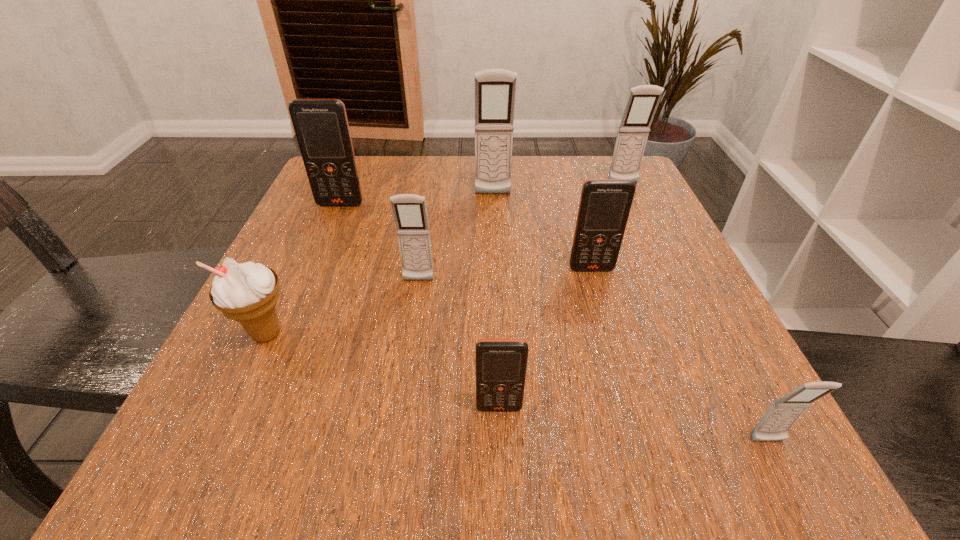
Image resolution: width=960 pixels, height=540 pixels. In order to click on free space between the nearest cellular telephone and the third biggest gray cellular telephone in this screenshot , I will do `click(593, 361)`.

Locate an element on the screen. free space between the nearest object and the leftmost orange cellular telephone is located at coordinates (554, 323).

Find the location of a particular element. vacant point located between the leftmost orange cellular telephone and the fifth cellular telephone from left to right is located at coordinates (466, 237).

Locate an element on the screen. The image size is (960, 540). object identified as the fifth closest to the nearest gray cellular telephone is located at coordinates point(495,89).

Find the location of a particular element. This screenshot has height=540, width=960. object that is the second closest one to the farthest orange cellular telephone is located at coordinates (409, 210).

The width and height of the screenshot is (960, 540). Find the location of `cellular telephone that is the sixth closest one to the fifth farthest object`. cellular telephone that is the sixth closest one to the fifth farthest object is located at coordinates (774, 425).

Identify which cellular telephone is located as the fifth nearest to the leftmost orange cellular telephone. Please provide its 2D coordinates. Your answer should be formatted as a tuple, i.e. [(x, y)], where the tuple contains the x and y coordinates of a point satisfying the conditions above.

[(643, 100)]

Find the location of a particular element. gray cellular telephone object that ranks as the second closest to the smallest gray cellular telephone is located at coordinates (643, 100).

Where is `gray cellular telephone that stands as the fourth closest to the nearest orange cellular telephone`? gray cellular telephone that stands as the fourth closest to the nearest orange cellular telephone is located at coordinates (643, 100).

This screenshot has height=540, width=960. In order to click on orange cellular telephone identified as the second closest to the white icecream in this screenshot , I will do `click(321, 126)`.